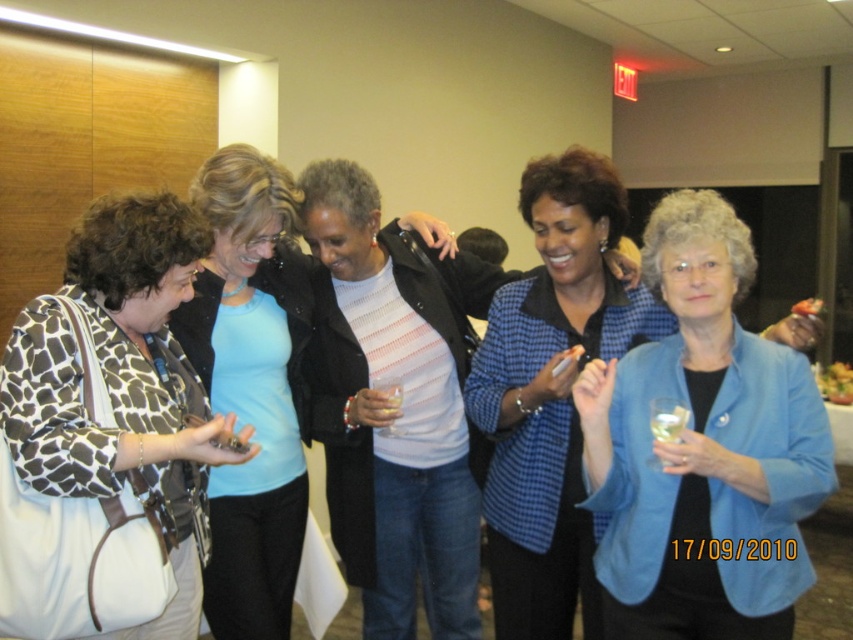
Question: From the image, what is the correct spatial relationship of brown giraffe print coat at left in relation to blue fabric jacket at right?

Choices:
 (A) below
 (B) above

Answer: (A)

Question: Is translucent glass at center bigger than clear glass at center?

Choices:
 (A) no
 (B) yes

Answer: (B)

Question: Which object is farther from the camera taking this photo?

Choices:
 (A) blue fabric jacket at right
 (B) translucent glass at center
 (C) brown giraffe print coat at left
 (D) clear glass at center

Answer: (B)

Question: Which object is farther from the camera taking this photo?

Choices:
 (A) blue textured blazer at center
 (B) blue fabric jacket at right

Answer: (A)

Question: Can you confirm if brown giraffe print coat at left is smaller than translucent glass at center?

Choices:
 (A) no
 (B) yes

Answer: (A)

Question: Which point appears closest to the camera in this image?

Choices:
 (A) (654, 406)
 (B) (274, 273)

Answer: (A)